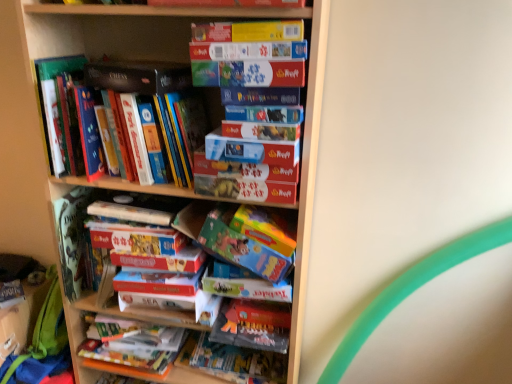
Question: Considering the relative positions of green fabric backpack at lower left and blue cardboard book at center, which ranks as the second paperback book in bottom-to-top order, in the image provided, is green fabric backpack at lower left to the right of blue cardboard book at center, which ranks as the second paperback book in bottom-to-top order, from the viewer's perspective?

Choices:
 (A) no
 (B) yes

Answer: (A)

Question: Is there a large distance between green fabric backpack at lower left and blue cardboard book at center, placed as the 7th paperback book when sorted from top to bottom?

Choices:
 (A) no
 (B) yes

Answer: (A)

Question: Is blue cardboard book at center, which ranks as the second paperback book in bottom-to-top order, inside green fabric backpack at lower left?

Choices:
 (A) yes
 (B) no

Answer: (B)

Question: Can you confirm if green fabric backpack at lower left is smaller than blue cardboard book at center, placed as the 7th paperback book when sorted from top to bottom?

Choices:
 (A) yes
 (B) no

Answer: (B)

Question: Does green fabric backpack at lower left have a larger size compared to blue cardboard book at center, which ranks as the second paperback book in bottom-to-top order?

Choices:
 (A) yes
 (B) no

Answer: (A)

Question: Considering the relative positions of green fabric backpack at lower left and blue cardboard book at center, placed as the 7th paperback book when sorted from top to bottom, in the image provided, is green fabric backpack at lower left to the left of blue cardboard book at center, placed as the 7th paperback book when sorted from top to bottom, from the viewer's perspective?

Choices:
 (A) yes
 (B) no

Answer: (A)

Question: Does matte cardboard book at center, which ranks as the fourth paperback book in top-to-bottom order, turn towards hardcover book at center, which is counted as the 8th paperback book, starting from the top?

Choices:
 (A) yes
 (B) no

Answer: (B)

Question: Does matte cardboard book at center, which ranks as the fourth paperback book in top-to-bottom order, contain hardcover book at center, which is counted as the 8th paperback book, starting from the top?

Choices:
 (A) no
 (B) yes

Answer: (A)

Question: From the image's perspective, does matte cardboard book at center, which is the fifth paperback book in bottom-to-top order, appear lower than hardcover book at center, which is the 1th paperback book from bottom to top?

Choices:
 (A) yes
 (B) no

Answer: (B)

Question: Can you confirm if matte cardboard book at center, which ranks as the fourth paperback book in top-to-bottom order, is bigger than hardcover book at center, which is the 1th paperback book from bottom to top?

Choices:
 (A) yes
 (B) no

Answer: (A)

Question: Is matte cardboard book at center, which is the fifth paperback book in bottom-to-top order, not close to hardcover book at center, which is the 1th paperback book from bottom to top?

Choices:
 (A) yes
 (B) no

Answer: (B)

Question: From a real-world perspective, is matte cardboard book at center, which is the fifth paperback book in bottom-to-top order, located beneath hardcover book at center, which is the 1th paperback book from bottom to top?

Choices:
 (A) yes
 (B) no

Answer: (B)

Question: From the image's perspective, would you say hardcover book at upper left, the 1th book from the top, is shown under matte cardboard book at upper center, which appears as the 7th paperback book when ordered from the bottom?

Choices:
 (A) no
 (B) yes

Answer: (B)